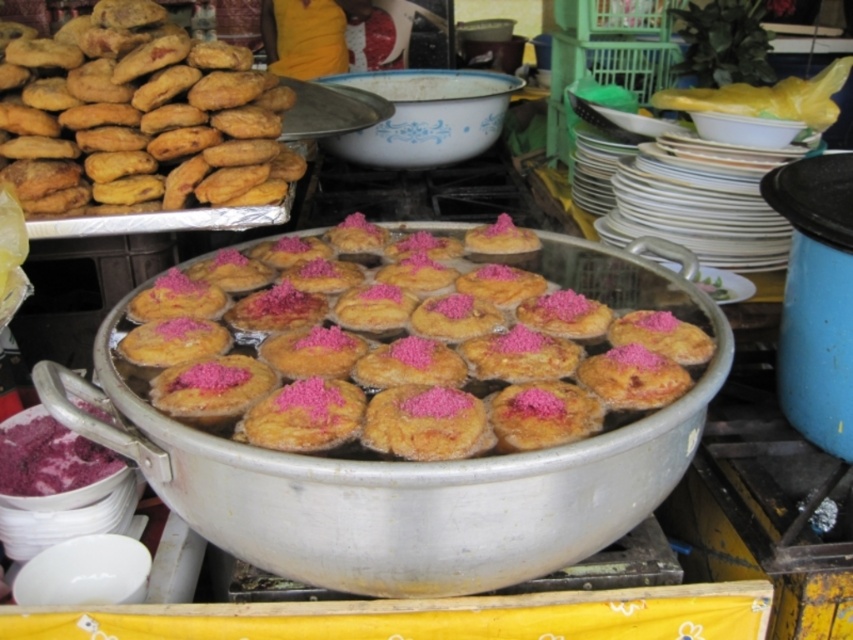
Between pink sugary treats at center and golden fried pastry at upper left, which one has less height?

pink sugary treats at center

Looking at this image, who is lower down, pink sugary treats at center or golden fried pastry at upper left?

pink sugary treats at center is below.

The height and width of the screenshot is (640, 853). In order to click on pink sugary treats at center in this screenshot , I will do `click(412, 353)`.

The width and height of the screenshot is (853, 640). Identify the location of pink sugary treats at center. [x=412, y=353].

Is point (252, 138) in front of point (94, 467)?

No, it is behind (94, 467).

The height and width of the screenshot is (640, 853). In order to click on golden fried pastry at upper left in this screenshot , I will do `click(140, 116)`.

Between point (225, 138) and point (16, 481), which one is positioned behind?

The point (225, 138) is more distant.

I want to click on golden fried pastry at upper left, so [140, 116].

Is pink sugary treats at center behind purple powder at lower left?

No.

Who is more distant from viewer, [500,356] or [10,477]?

The point [10,477] is more distant.

Where is `pink sugary treats at center`? pink sugary treats at center is located at coordinates (412, 353).